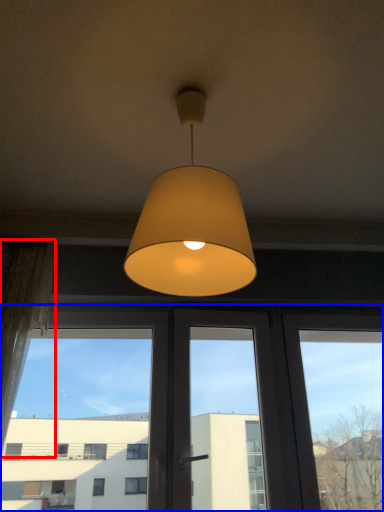
Question: Which object is closer to the camera taking this photo, curtain (highlighted by a red box) or window (highlighted by a blue box)?

Choices:
 (A) curtain
 (B) window

Answer: (A)